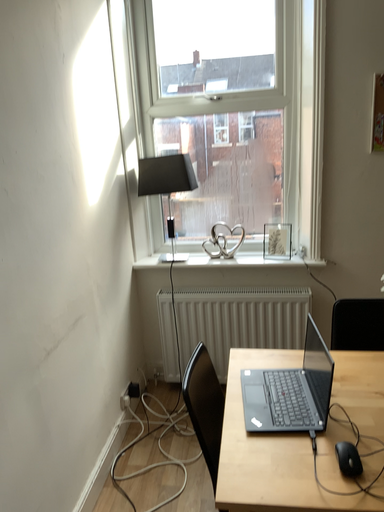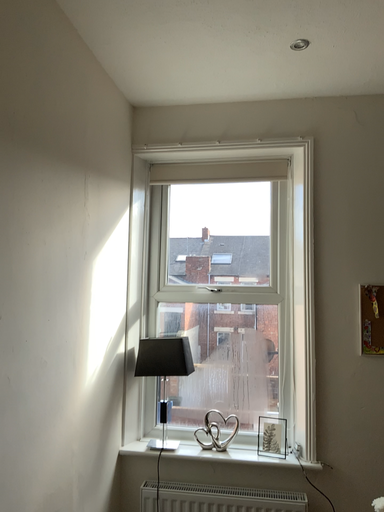
Question: Which way did the camera rotate in the video?

Choices:
 (A) rotated downward
 (B) rotated upward

Answer: (B)